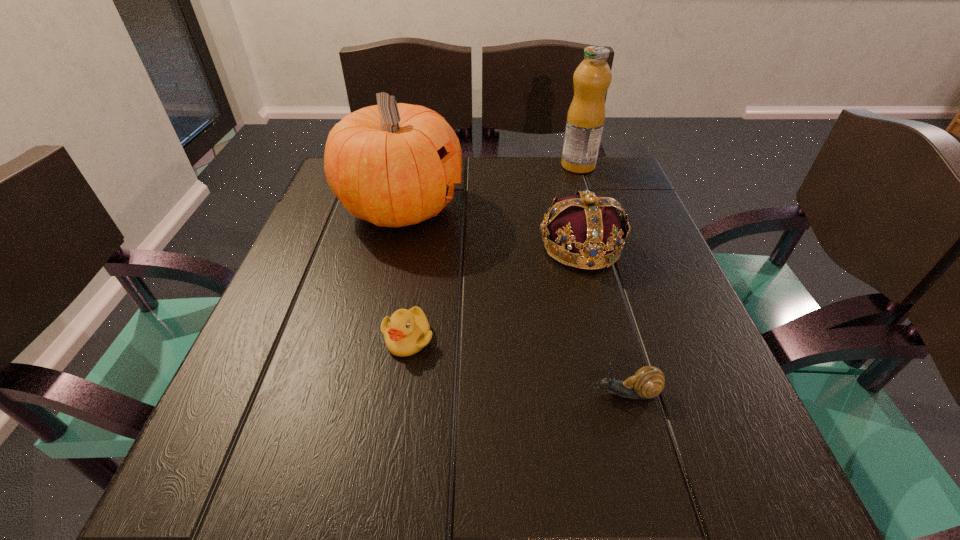
Identify the location of free region located on the front-facing side of the pumpkin. Image resolution: width=960 pixels, height=540 pixels. (581, 208).

Image resolution: width=960 pixels, height=540 pixels. In order to click on free space located 0.180m on the back of the third tallest object in this screenshot , I will do `click(564, 179)`.

You are a GUI agent. You are given a task and a screenshot of the screen. Output one action in this format:
    pyautogui.click(x=<x>, y=<y>)
    Task: Click on the vacant space located on the front-facing side of the fourth tallest object
    
    Given the screenshot: What is the action you would take?
    pyautogui.click(x=391, y=450)

You are a GUI agent. You are given a task and a screenshot of the screen. Output one action in this format:
    pyautogui.click(x=<x>, y=<y>)
    Task: Click on the vacant space located on the front-facing side of the shortest object
    This screenshot has height=540, width=960.
    Given the screenshot: What is the action you would take?
    pyautogui.click(x=323, y=393)

Find the location of a particular element. This screenshot has width=960, height=540. vacant space located 0.220m on the front-facing side of the shortest object is located at coordinates (444, 393).

Locate an element on the screen. The image size is (960, 540). vacant area situated 0.080m on the front-facing side of the shortest object is located at coordinates (538, 393).

Image resolution: width=960 pixels, height=540 pixels. I want to click on fruit juice located at the far edge, so click(585, 120).

Identify the location of pumpkin present at the far edge. This screenshot has height=540, width=960. (393, 164).

Where is `object positioned at the left edge`? This screenshot has height=540, width=960. object positioned at the left edge is located at coordinates (393, 164).

Locate an element on the screen. fruit juice located at the right edge is located at coordinates (585, 120).